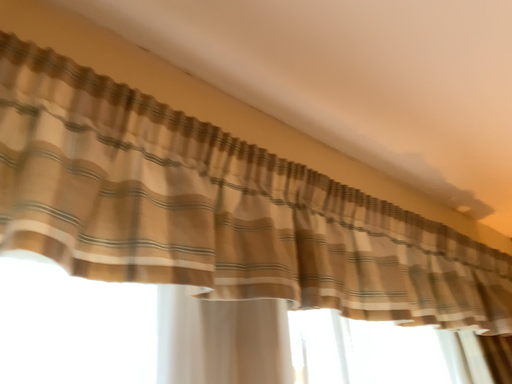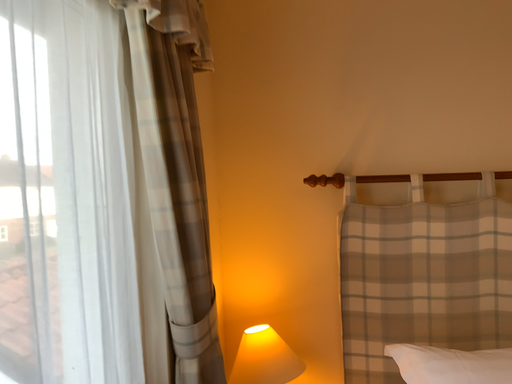
Question: Which way did the camera rotate in the video?

Choices:
 (A) rotated left
 (B) rotated right

Answer: (B)